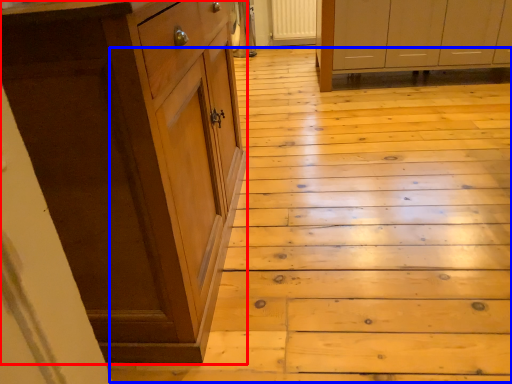
Question: Which point is further to the camera, cabinetry (highlighted by a red box) or stair (highlighted by a blue box)?

Choices:
 (A) cabinetry
 (B) stair

Answer: (B)